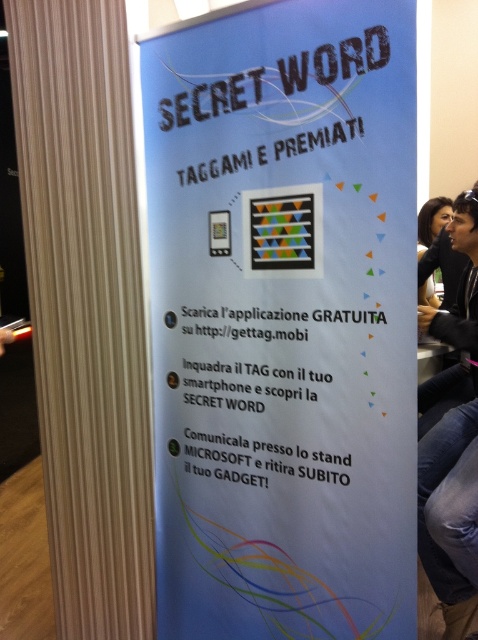
Which of these two, blue paper poster at center or dark hair at upper right, stands shorter?

With less height is dark hair at upper right.

Who is higher up, blue paper poster at center or dark hair at upper right?

dark hair at upper right is above.

Does point (170, 161) lie behind point (464, 381)?

No.

I want to click on blue paper poster at center, so click(283, 320).

Is point (274, 481) in front of point (421, 285)?

Yes.

Between blue paper poster at center and matte black hair at upper right, which one is positioned lower?

Positioned lower is blue paper poster at center.

Does point (368, 516) come in front of point (448, 268)?

Yes, it is.

Image resolution: width=478 pixels, height=640 pixels. I want to click on blue paper poster at center, so click(283, 320).

Does dark hair at upper right have a larger size compared to matte black hair at upper right?

Indeed, dark hair at upper right has a larger size compared to matte black hair at upper right.

Find the location of a particular element. This screenshot has width=478, height=640. dark hair at upper right is located at coordinates (446, 332).

Who is more forward, (460, 368) or (431, 264)?

Point (460, 368)

Locate an element on the screen. The width and height of the screenshot is (478, 640). dark hair at upper right is located at coordinates (446, 332).